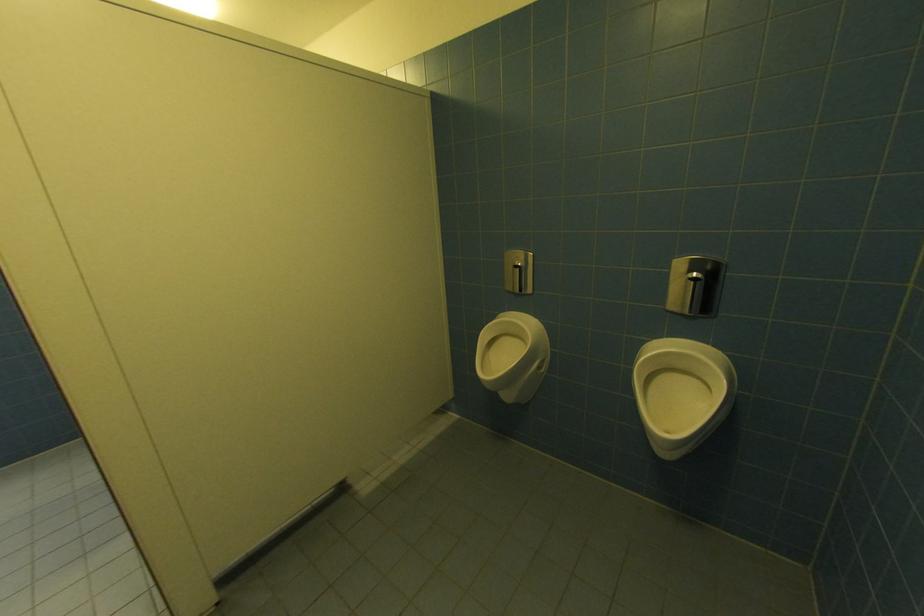
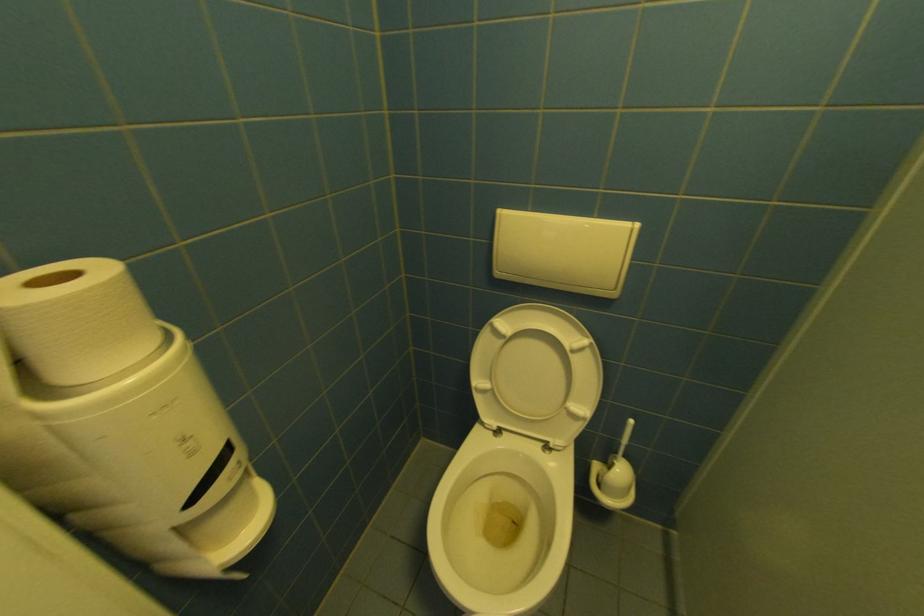
In a continuous first-person perspective shot, in which direction is the camera moving?

The cameraman moved toward left, forward.